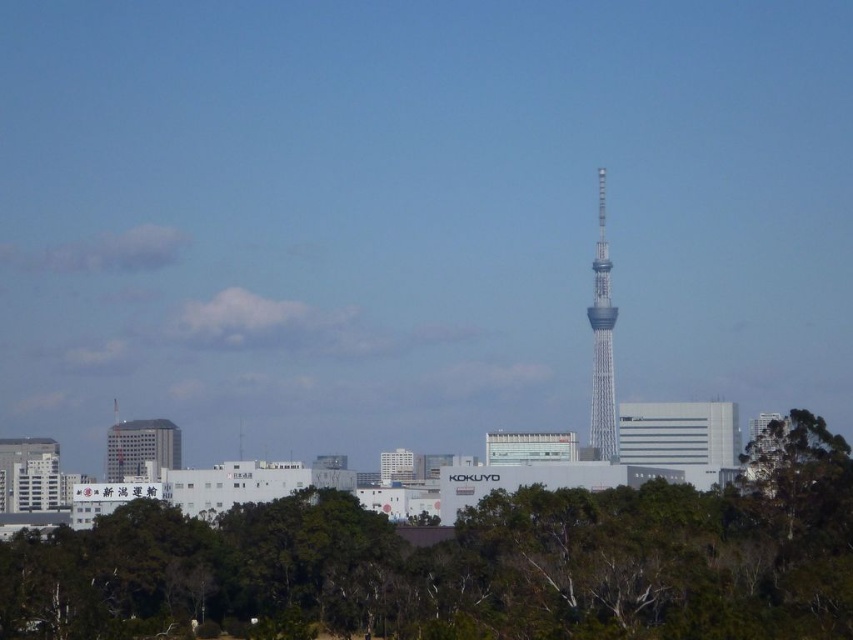
Who is positioned more to the left, green leafy trees at lower center or matte gray building at center-left?

matte gray building at center-left is more to the left.

Measure the distance between green leafy trees at lower center and matte gray building at center-left.

159.80 feet

The image size is (853, 640). Identify the location of green leafy trees at lower center. (463, 564).

This screenshot has height=640, width=853. Identify the location of green leafy trees at lower center. (463, 564).

In the scene shown: Between white glass tower at center and matte gray building at center-left, which one has less height?

matte gray building at center-left

Who is positioned more to the right, white glass tower at center or matte gray building at center-left?

white glass tower at center is more to the right.

Where is `white glass tower at center`? white glass tower at center is located at coordinates (602, 340).

The width and height of the screenshot is (853, 640). What are the coordinates of `white glass tower at center` in the screenshot? It's located at (602, 340).

Between green leafy trees at lower center and white glass tower at center, which one appears on the right side from the viewer's perspective?

white glass tower at center is more to the right.

Is point (819, 490) less distant than point (596, 356)?

That is False.

You are a GUI agent. You are given a task and a screenshot of the screen. Output one action in this format:
    pyautogui.click(x=<x>, y=<y>)
    Task: Click on the green leafy trees at lower center
    This screenshot has height=640, width=853.
    Given the screenshot: What is the action you would take?
    pyautogui.click(x=463, y=564)

This screenshot has width=853, height=640. In order to click on green leafy trees at lower center in this screenshot , I will do `click(463, 564)`.